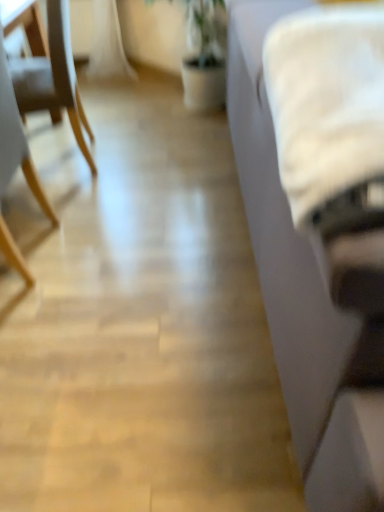
Question: Is wooden chair at left, placed as the second chair when sorted from back to front, situated inside light wood chair at left, which appears as the 1th chair when viewed from the back, or outside?

Choices:
 (A) outside
 (B) inside

Answer: (A)

Question: From the image's perspective, is wooden chair at left, placed as the second chair when sorted from back to front, above or below light wood chair at left, which is the second chair from front to back?

Choices:
 (A) above
 (B) below

Answer: (B)

Question: Which object is the farthest from the white fabric couch at right?

Choices:
 (A) white fluffy blanket at right
 (B) light wood chair at left, which appears as the 1th chair when viewed from the back
 (C) wooden chair at left, which appears as the 1th chair when viewed from the front

Answer: (B)

Question: Estimate the real-world distances between objects in this image. Which object is closer to the white fabric couch at right?

Choices:
 (A) light wood chair at left, which appears as the 1th chair when viewed from the back
 (B) white fluffy blanket at right
 (C) wooden chair at left, placed as the second chair when sorted from back to front

Answer: (B)